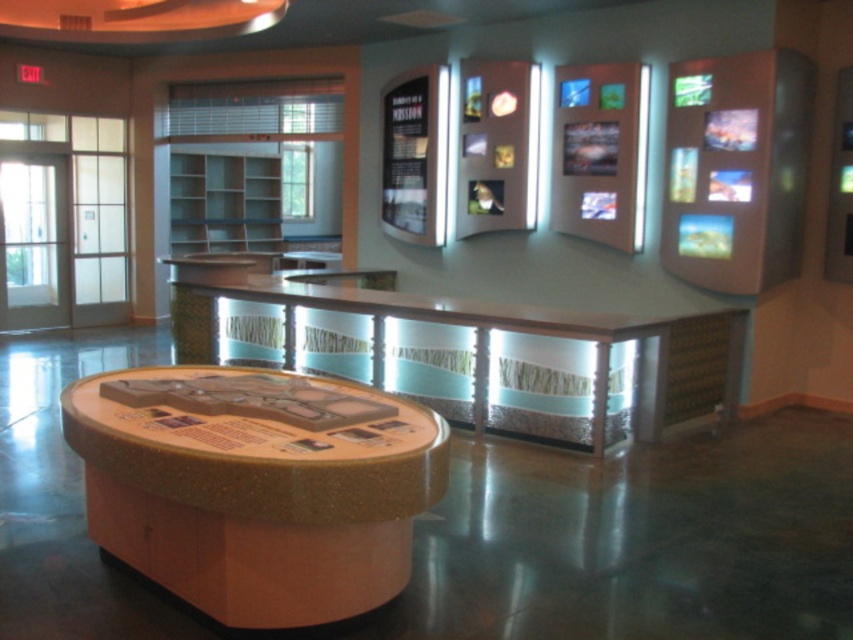
You are an event planner setting up for a presentation in the museum. You need to place a large banner that requires a table wider than 1.2 meters. Which table between the wooden textured table at center and the smooth polished wood table at center should you choose?

The smooth polished wood table at center has a greater width than the wooden textured table at center, so you should choose the smooth polished wood table at center for placing the large banner.

You are standing at the entrance of the museum hall and want to find the wooden textured table at center. According to the coordinates provided, where should you look to locate it?

The wooden textured table at center is located at the 2D coordinates point (256,486).